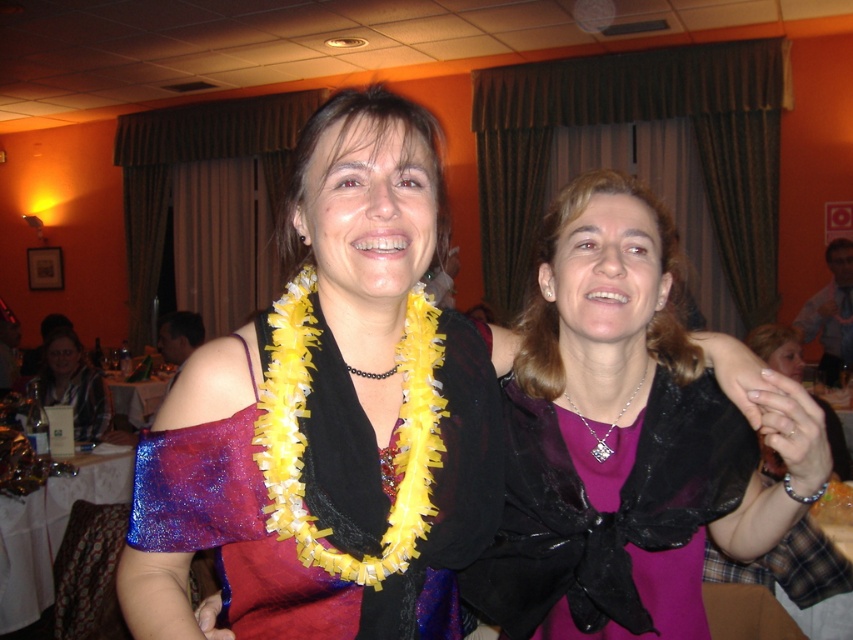
You are a photographer at the event and want to take a photo focusing on the purple satin blouse at center and the purple satin dress at center. Which one is positioned in front of the other?

The purple satin blouse at center is closer to the viewer than the purple satin dress at center, so it is positioned in front of the purple satin dress at center.

Consider the image. You are standing at the entrance of the room and want to greet both the purple satin dress at center and the plaid shirt at left. Which one should you approach first if you want to greet the person closest to the entrance?

The plaid shirt at left is closer to the entrance than the purple satin dress at center, so you should approach the plaid shirt at left first.

You are a photographer at a social event and need to decide which dress to focus on for a closeup. The shiny purple fabric dress at center and the purple satin dress at center are both in view. Which dress should you choose if you want to capture the one that takes up more space in the frame?

The shiny purple fabric dress at center has a larger size compared to the purple satin dress at center, so you should choose the shiny purple fabric dress at center for the closeup as it occupies more space in the frame.